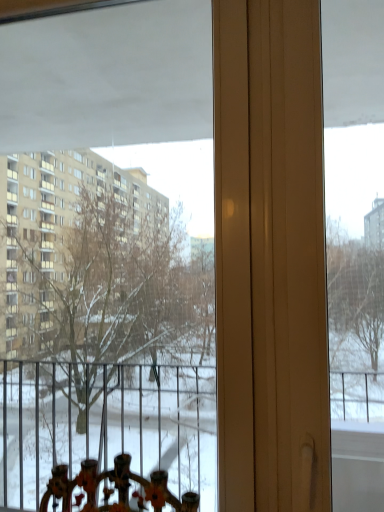
Question: Is point (344, 33) closer or farther from the camera than point (205, 426)?

Choices:
 (A) closer
 (B) farther

Answer: (A)

Question: Is transparent plastic screen at center to the left or to the right of transparent glass window at center in the image?

Choices:
 (A) left
 (B) right

Answer: (B)

Question: In the image, is transparent plastic screen at center positioned in front of or behind transparent glass window at center?

Choices:
 (A) front
 (B) behind

Answer: (A)

Question: Is transparent glass window at center wider or thinner than transparent plastic screen at center?

Choices:
 (A) wide
 (B) thin

Answer: (B)

Question: Is transparent glass window at center situated inside transparent plastic screen at center or outside?

Choices:
 (A) outside
 (B) inside

Answer: (A)

Question: From the image's perspective, relative to transparent plastic screen at center, is transparent glass window at center above or below?

Choices:
 (A) above
 (B) below

Answer: (A)

Question: Considering the positions of transparent glass window at center and transparent plastic screen at center in the image, is transparent glass window at center taller or shorter than transparent plastic screen at center?

Choices:
 (A) short
 (B) tall

Answer: (B)